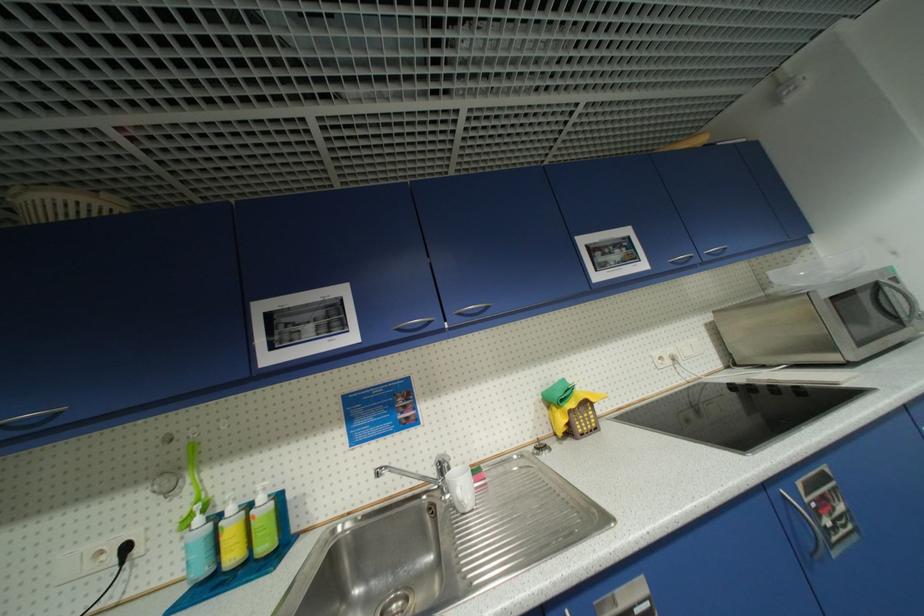
This screenshot has height=616, width=924. Identify the location of green dispenser pump. (261, 496).